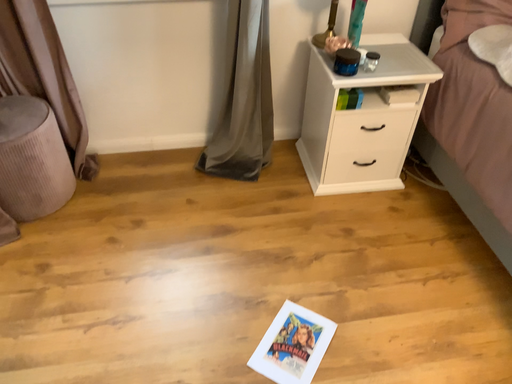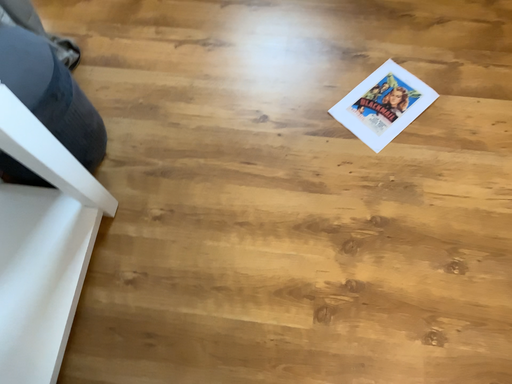
Question: How did the camera likely rotate when shooting the video?

Choices:
 (A) rotated right
 (B) rotated left

Answer: (B)